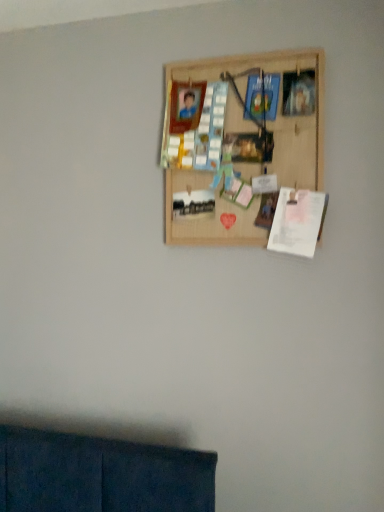
What is the approximate height of wooden board at upper center?

It is 25.92 inches.

In order to face wooden board at upper center, should I rotate leftwards or rightwards?

To face it directly, rotate right by 6.319 degrees.

The width and height of the screenshot is (384, 512). What do you see at coordinates (242, 140) in the screenshot?
I see `wooden board at upper center` at bounding box center [242, 140].

Identify the location of wooden board at upper center. (242, 140).

In order to click on wooden board at upper center in this screenshot , I will do `click(242, 140)`.